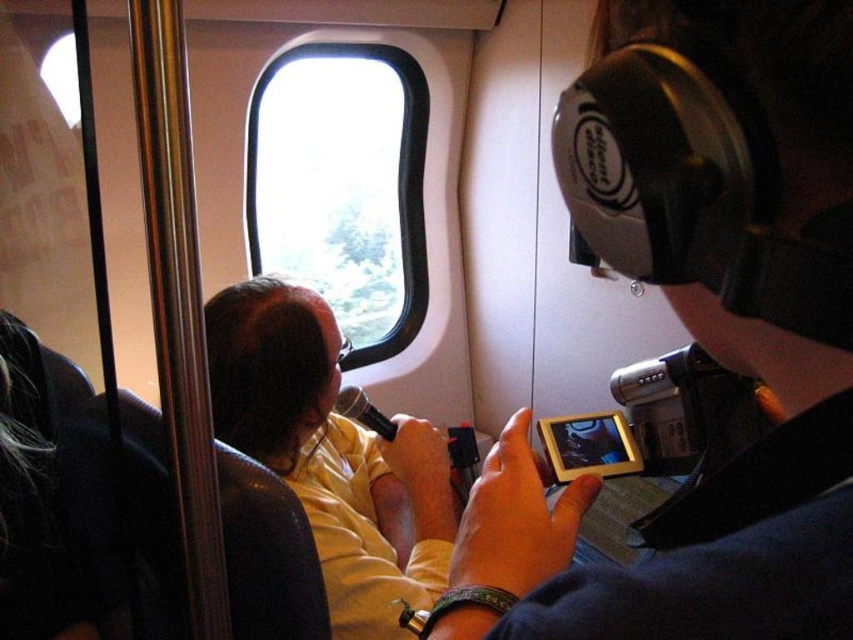
Question: Does silent disco headphones at upper right appear on the right side of transparent glass airplane window at upper center?

Choices:
 (A) no
 (B) yes

Answer: (B)

Question: Does silent disco headphones at upper right have a lesser width compared to yellow matte shirt at center?

Choices:
 (A) yes
 (B) no

Answer: (A)

Question: Among these objects, which one is nearest to the camera?

Choices:
 (A) transparent glass airplane window at upper center
 (B) silent disco headphones at upper right
 (C) yellow matte shirt at center

Answer: (B)

Question: Among these points, which one is farthest from the camera?

Choices:
 (A) (308, 198)
 (B) (291, 476)
 (C) (469, 634)

Answer: (A)

Question: Does silent disco headphones at upper right come in front of yellow matte shirt at center?

Choices:
 (A) yes
 (B) no

Answer: (A)

Question: Which of the following is the farthest from the observer?

Choices:
 (A) (544, 577)
 (B) (258, 173)
 (C) (312, 435)

Answer: (B)